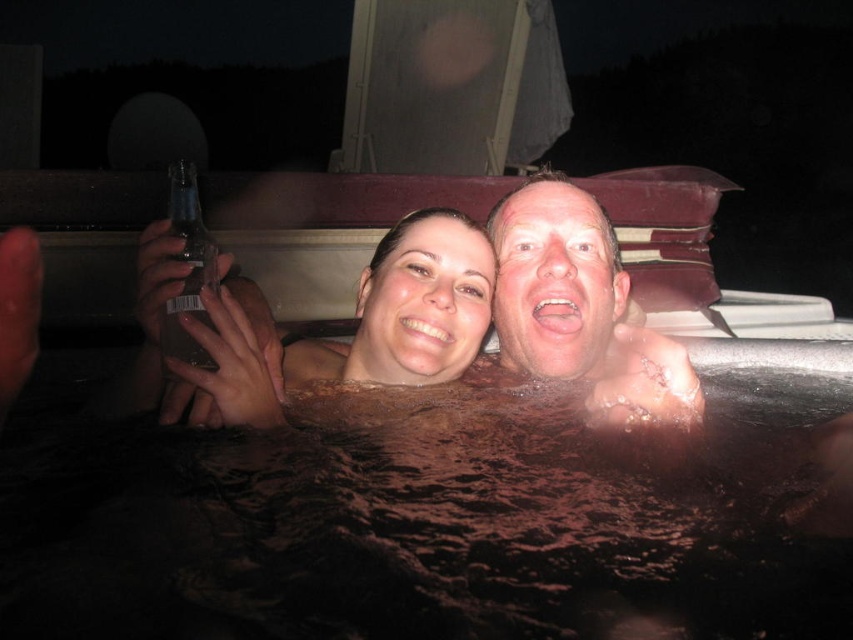
Between smooth skin face at center and clear glass bottle at left, which one appears on the left side from the viewer's perspective?

clear glass bottle at left

You are a GUI agent. You are given a task and a screenshot of the screen. Output one action in this format:
    pyautogui.click(x=<x>, y=<y>)
    Task: Click on the smooth skin face at center
    
    Given the screenshot: What is the action you would take?
    pyautogui.click(x=579, y=308)

Which of these two, brown plastic tub at center or smooth skin couple at center, stands shorter?

Standing shorter between the two is smooth skin couple at center.

Who is lower down, brown plastic tub at center or smooth skin couple at center?

brown plastic tub at center

Does point (741, 550) lie behind point (550, 292)?

No, (741, 550) is closer to viewer.

The width and height of the screenshot is (853, 640). In order to click on brown plastic tub at center in this screenshot , I will do `click(418, 524)`.

What do you see at coordinates (418, 524) in the screenshot? I see `brown plastic tub at center` at bounding box center [418, 524].

Does point (144, 484) lie in front of point (596, 358)?

Yes, it is.

Who is more forward, (605,492) or (502,355)?

Point (605,492) is more forward.

At what (x,y) coordinates should I click in order to perform the action: click on brown plastic tub at center. Please return your answer as a coordinate pair (x, y). The image size is (853, 640). Looking at the image, I should click on (418, 524).